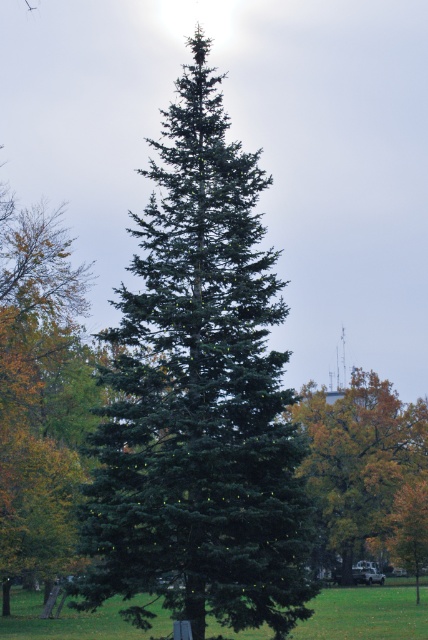
You are standing in a park and see the green matte tree at center and the green grass at center. Which object is positioned to the left?

The green matte tree at center is located to the left of the green grass at center.

From the picture: You are standing in a park and see the green matte tree at center and the golden yellow leaves at center. Which object is closer to you?

The green matte tree at center is closer to you because it is positioned over the golden yellow leaves at center, indicating it is in front.

You are standing in a park and see a green matte tree at center with coordinates marked at point (x=199, y=397). Can you tell me what is located at those coordinates?

The point (x=199, y=397) is located on the green matte tree at center.